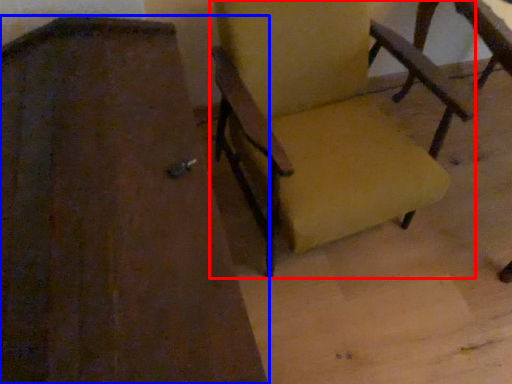
Question: Among these objects, which one is farthest to the camera, chair (highlighted by a red box) or chair (highlighted by a blue box)?

Choices:
 (A) chair
 (B) chair

Answer: (A)